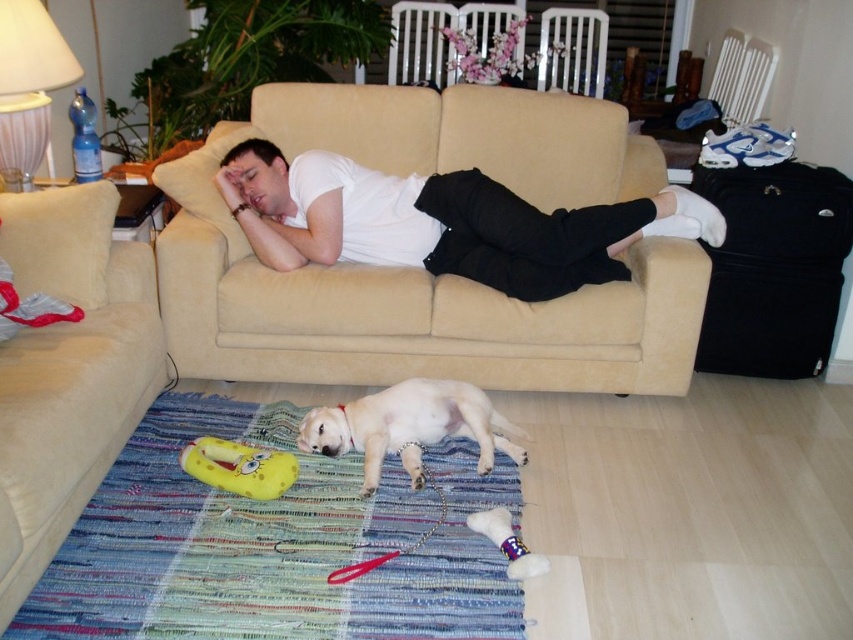
Question: In this image, where is white matte shirt at center located relative to plush yellow dog toy at lower center?

Choices:
 (A) below
 (B) above

Answer: (B)

Question: Is beige fabric couch at center wider than white fur dog at lower center?

Choices:
 (A) yes
 (B) no

Answer: (A)

Question: Which of the following is the farthest from the observer?

Choices:
 (A) (321, 410)
 (B) (212, 474)

Answer: (A)

Question: Which of these objects is positioned farthest from the beige fabric couch at center?

Choices:
 (A) beige fabric couch at lower left
 (B) white matte shirt at center
 (C) white fur dog at lower center
 (D) yellow rubber dog toy at lower center

Answer: (A)

Question: Which point is closer to the camera?

Choices:
 (A) white matte shirt at center
 (B) white fur dog at lower center
 (C) plush yellow dog toy at lower center
 (D) beige fabric couch at center

Answer: (C)

Question: Can you confirm if white fur dog at lower center is positioned to the right of yellow rubber dog toy at lower center?

Choices:
 (A) yes
 (B) no

Answer: (A)